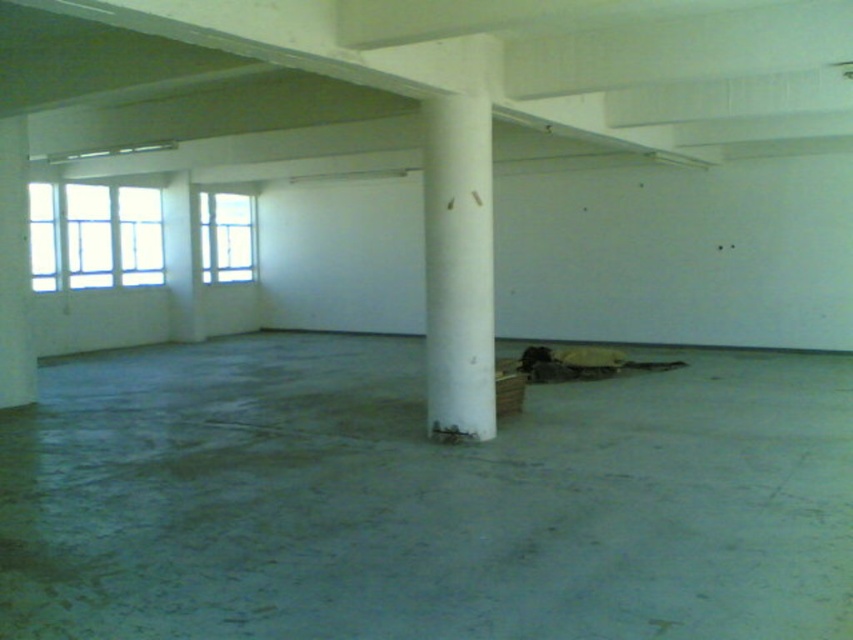
Question: Can you confirm if white smooth column at center is bigger than clear glass windows at upper left?

Choices:
 (A) yes
 (B) no

Answer: (B)

Question: Which is nearer to the clear glass windows at upper left?

Choices:
 (A) clear glass window at upper left
 (B) white smooth column at center

Answer: (A)

Question: Which point is farther from the camera taking this photo?

Choices:
 (A) (82, 212)
 (B) (253, 198)

Answer: (B)

Question: Estimate the real-world distances between objects in this image. Which object is closer to the white smooth column at center?

Choices:
 (A) clear glass window at upper left
 (B) clear glass windows at upper left

Answer: (B)

Question: Is white smooth column at center to the right of clear glass window at upper left from the viewer's perspective?

Choices:
 (A) no
 (B) yes

Answer: (B)

Question: In this image, where is clear glass windows at upper left located relative to clear glass window at upper left?

Choices:
 (A) left
 (B) right

Answer: (A)